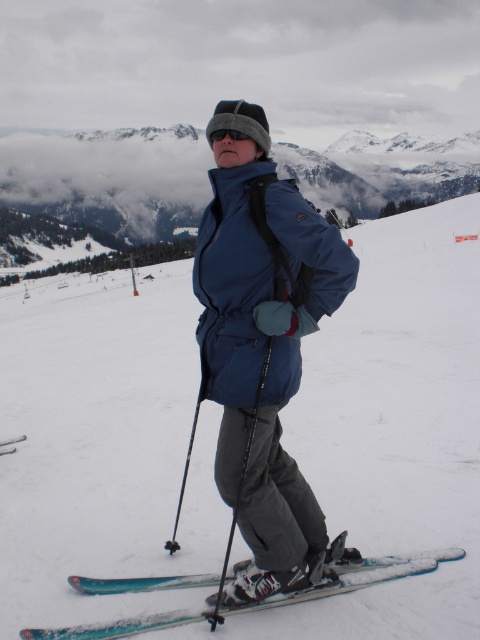
Is teal glossy skis at lower center wider than black matte goggles at center?

Yes.

Where is `teal glossy skis at lower center`? teal glossy skis at lower center is located at coordinates (358, 577).

Does point (106, 637) come in front of point (238, 138)?

That is True.

I want to click on teal glossy skis at lower center, so coord(358,577).

Who is higher up, blue fabric ski slope at center or blue metallic ski at lower left?

blue fabric ski slope at center

How much distance is there between blue fabric ski slope at center and blue metallic ski at lower left?

The distance of blue fabric ski slope at center from blue metallic ski at lower left is 32.25 meters.

Measure the distance between point (130, 515) and camera.

Point (130, 515) and camera are 13.31 meters apart.

Where is `blue fabric ski slope at center`? Image resolution: width=480 pixels, height=640 pixels. blue fabric ski slope at center is located at coordinates (103, 445).

Which is below, blue fabric ski slope at center or teal glossy skis at lower center?

teal glossy skis at lower center

The image size is (480, 640). I want to click on blue fabric ski slope at center, so click(x=103, y=445).